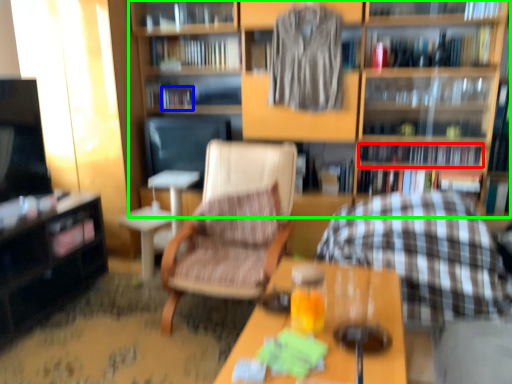
Question: Which object is positioned farthest from book (highlighted by a red box)? Select from book (highlighted by a blue box) and shelf (highlighted by a green box).

Choices:
 (A) book
 (B) shelf

Answer: (A)